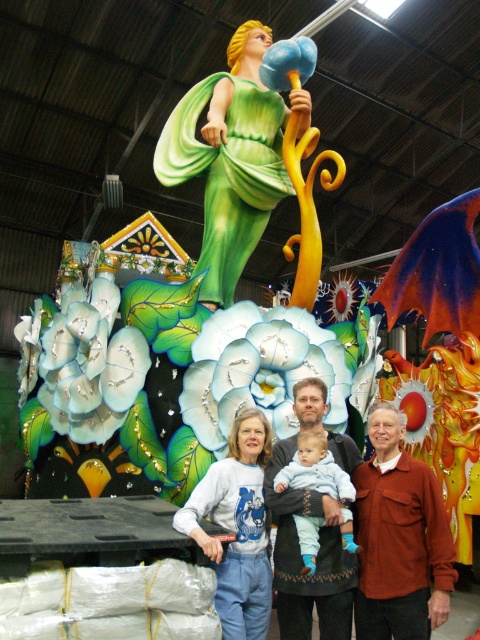
You are an event planner standing in the workshop and need to place a new decorative item near the smooth green dress at center. Based on its coordinates, where should you position the new item to ensure it is adjacent to the dress?

The smooth green dress at center is located at point (228, 160), so you should position the new item near those coordinates to place it adjacent to the dress.

You are organizing a clothing donation drive and need to determine which items are larger to sort them into appropriate bins. You see a dark brown leather jacket at center and a matte gray sweater at center. Which item should you place in the bin labeled for larger garments?

The dark brown leather jacket at center is bigger than the matte gray sweater at center, so you should place the dark brown leather jacket at center in the bin labeled for larger garments.